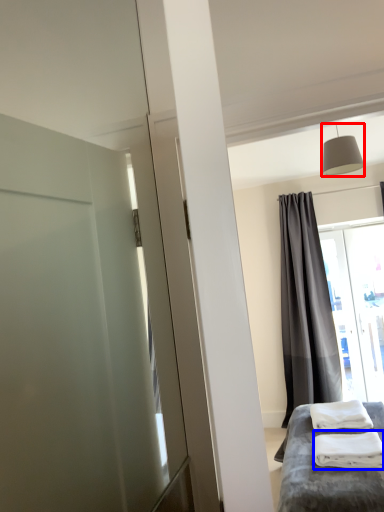
Question: Which point is closer to the camera, light fixture (highlighted by a red box) or material (highlighted by a blue box)?

Choices:
 (A) light fixture
 (B) material

Answer: (B)